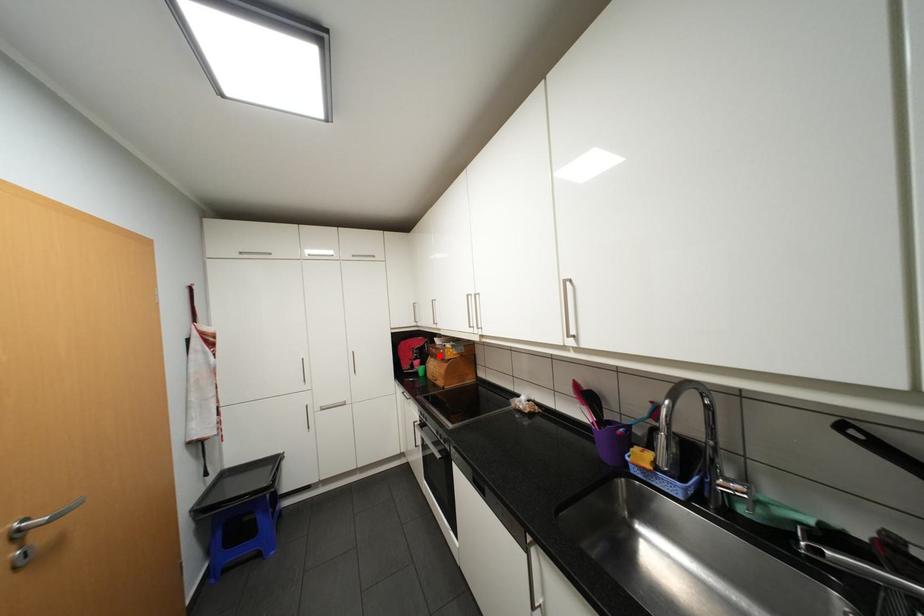
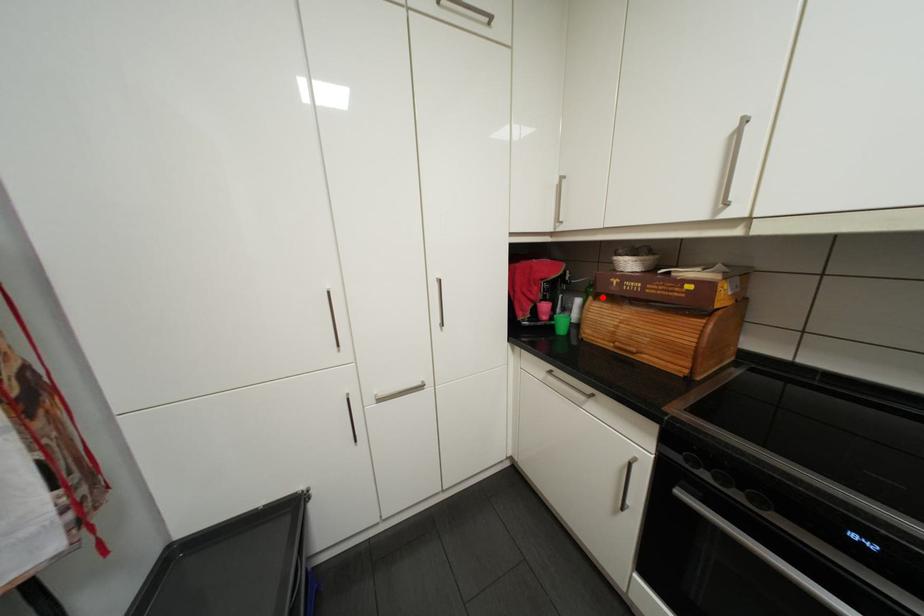
Consider the image. I am providing you with two images of the same scene from different viewpoints. A red point is marked on the first image and another point is marked on the second image. Are the points marked in image1 and image2 representing the same 3D position?

Yes